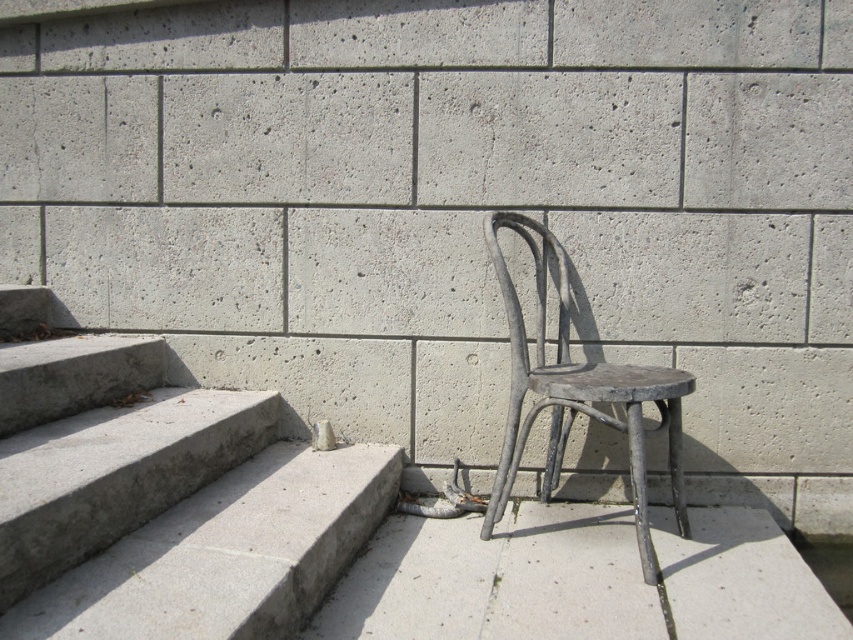
From the picture: You are a painter who needs to decide which object to paint first. The gray concrete stairs at lower left and the rusty metal chair at center are both in need of a fresh coat. Given that you want to start with the larger object, which one should you choose?

The gray concrete stairs at lower left has a larger size compared to the rusty metal chair at center, so you should start painting the gray concrete stairs at lower left first.

You are standing on the gray concrete at lower right and want to reach the gray concrete stairs at lower left. Which direction should you move to get there?

You should move upward to reach the gray concrete stairs at lower left from the gray concrete at lower right since the stairs are positioned above it.